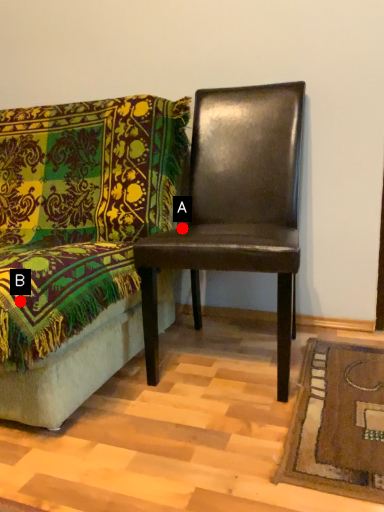
Question: Two points are circled on the image, labeled by A and B beside each circle. Which of the following is the farthest from the observer?

Choices:
 (A) A is further
 (B) B is further

Answer: (A)